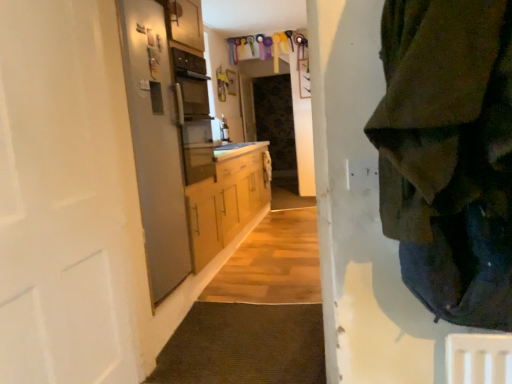
Question: Can you confirm if white matte door at left is thinner than dark green fabric at right?

Choices:
 (A) yes
 (B) no

Answer: (A)

Question: Are white matte door at left and dark green fabric at right making contact?

Choices:
 (A) yes
 (B) no

Answer: (B)

Question: Could you tell me if white matte door at left is facing dark green fabric at right?

Choices:
 (A) yes
 (B) no

Answer: (A)

Question: Is white matte door at left to the right of dark green fabric at right from the viewer's perspective?

Choices:
 (A) yes
 (B) no

Answer: (B)

Question: Considering the relative sizes of white matte door at left and dark green fabric at right in the image provided, is white matte door at left wider than dark green fabric at right?

Choices:
 (A) yes
 (B) no

Answer: (B)

Question: Looking at the image, does dark green fabric at right seem bigger or smaller compared to white matte door at left?

Choices:
 (A) small
 (B) big

Answer: (A)

Question: Considering the positions of point (485, 307) and point (68, 82), is point (485, 307) closer or farther from the camera than point (68, 82)?

Choices:
 (A) closer
 (B) farther

Answer: (A)

Question: Is dark green fabric at right in front of or behind white matte door at left in the image?

Choices:
 (A) behind
 (B) front

Answer: (B)

Question: In terms of width, does dark green fabric at right look wider or thinner when compared to white matte door at left?

Choices:
 (A) thin
 (B) wide

Answer: (B)

Question: From their relative heights in the image, would you say satin silver refrigerator at left is taller or shorter than dark green fabric at right?

Choices:
 (A) short
 (B) tall

Answer: (B)

Question: From the image's perspective, relative to dark green fabric at right, is satin silver refrigerator at left above or below?

Choices:
 (A) below
 (B) above

Answer: (A)

Question: Choose the correct answer: Is satin silver refrigerator at left inside dark green fabric at right or outside it?

Choices:
 (A) inside
 (B) outside

Answer: (B)

Question: Based on their sizes in the image, would you say satin silver refrigerator at left is bigger or smaller than dark green fabric at right?

Choices:
 (A) big
 (B) small

Answer: (B)

Question: Considering the positions of satin silver refrigerator at left and white matte door at left in the image, is satin silver refrigerator at left taller or shorter than white matte door at left?

Choices:
 (A) short
 (B) tall

Answer: (B)

Question: In terms of width, does satin silver refrigerator at left look wider or thinner when compared to white matte door at left?

Choices:
 (A) thin
 (B) wide

Answer: (A)